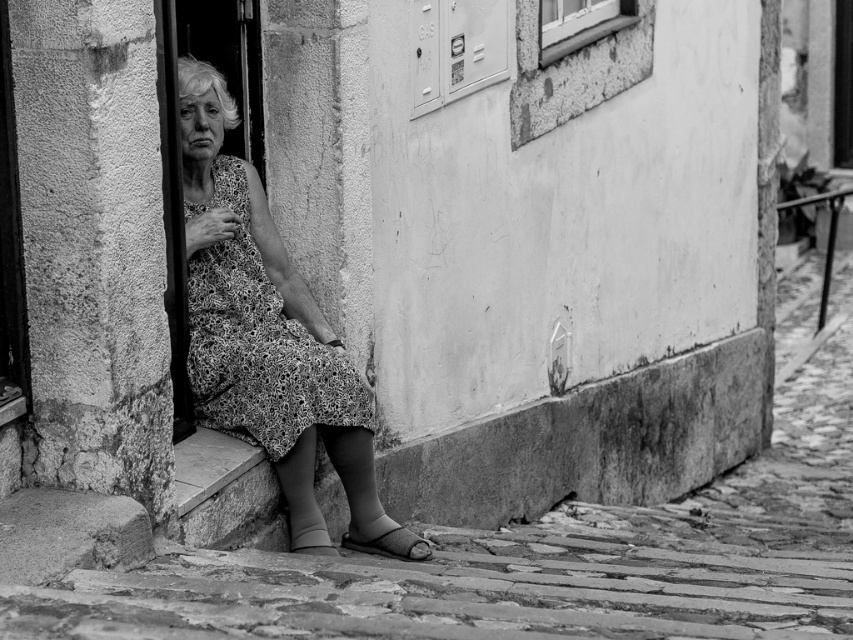
Question: In this image, where is floral dress at left located relative to floral-patterned fabric dress at center?

Choices:
 (A) left
 (B) right

Answer: (B)

Question: Which of the following is the closest to the observer?

Choices:
 (A) floral dress at left
 (B) floral-patterned fabric dress at center

Answer: (B)

Question: Does floral dress at left appear on the left side of floral-patterned fabric dress at center?

Choices:
 (A) yes
 (B) no

Answer: (B)

Question: Is floral dress at left wider than floral-patterned fabric dress at center?

Choices:
 (A) no
 (B) yes

Answer: (B)

Question: Which of the following is the closest to the observer?

Choices:
 (A) (328, 536)
 (B) (305, 349)

Answer: (B)

Question: Which point appears closest to the camera in this image?

Choices:
 (A) (331, 419)
 (B) (222, 372)

Answer: (A)